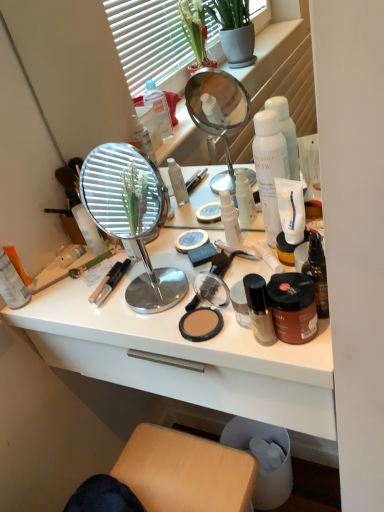
The height and width of the screenshot is (512, 384). What are the coordinates of `free point behind silver/metallic mirror at center` in the screenshot? It's located at (142, 257).